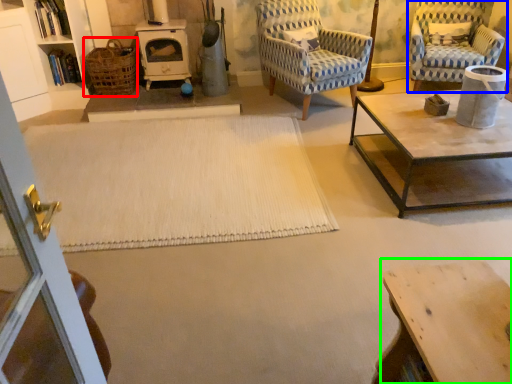
Question: Which object is the closest to the basket (highlighted by a red box)? Choose among these: chair (highlighted by a blue box) or table (highlighted by a green box).

Choices:
 (A) chair
 (B) table

Answer: (A)